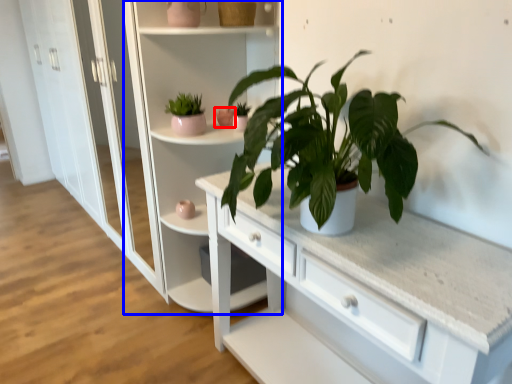
Question: Which object appears closest to the camera in this image, flowerpot (highlighted by a red box) or bookshelf (highlighted by a blue box)?

Choices:
 (A) flowerpot
 (B) bookshelf

Answer: (B)